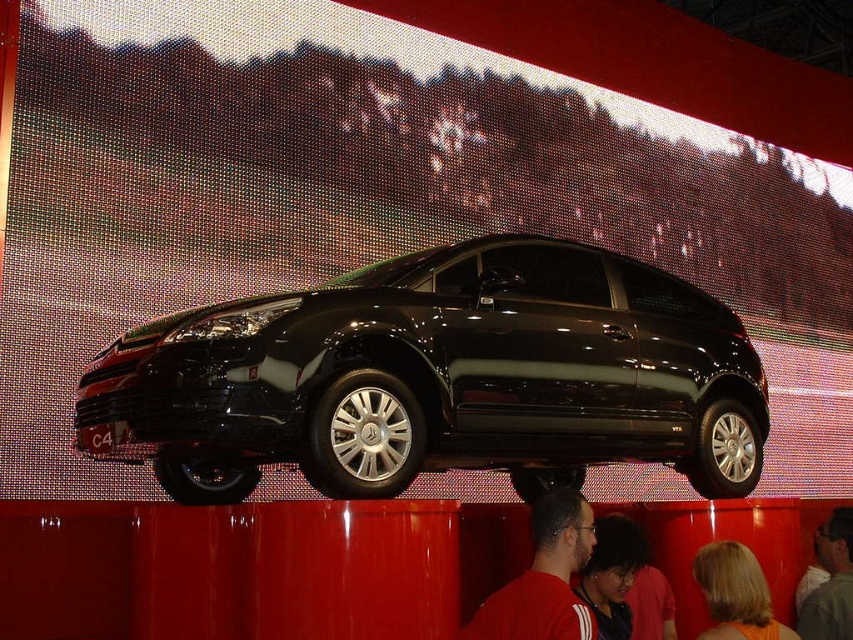
Question: Does red shirt at center appear on the right side of blonde hair at lower right?

Choices:
 (A) yes
 (B) no

Answer: (B)

Question: Which of the following is the closest to the observer?

Choices:
 (A) (486, 616)
 (B) (405, 371)
 (C) (721, 568)
 (D) (834, 516)

Answer: (A)

Question: Is red shirt at center further to the viewer compared to smooth white shirt at center?

Choices:
 (A) yes
 (B) no

Answer: (B)

Question: Which point is farther to the camera?

Choices:
 (A) glossy black car at center
 (B) blonde hair at lower right
 (C) smooth white shirt at center
 (D) red shirt at center

Answer: (C)

Question: Which point is farther to the camera?

Choices:
 (A) smooth white shirt at center
 (B) blonde hair at lower right

Answer: (A)

Question: Does glossy black car at center come in front of red shirt at center?

Choices:
 (A) yes
 (B) no

Answer: (B)